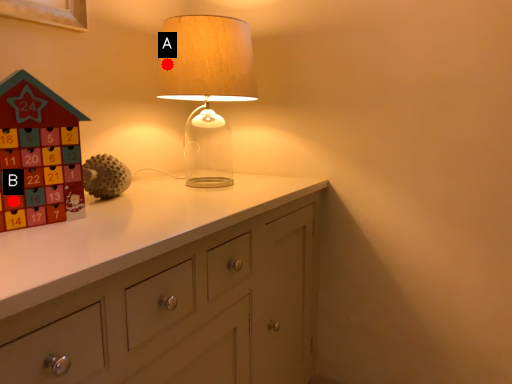
Question: Two points are circled on the image, labeled by A and B beside each circle. Which point is closer to the camera?

Choices:
 (A) A is closer
 (B) B is closer

Answer: (B)